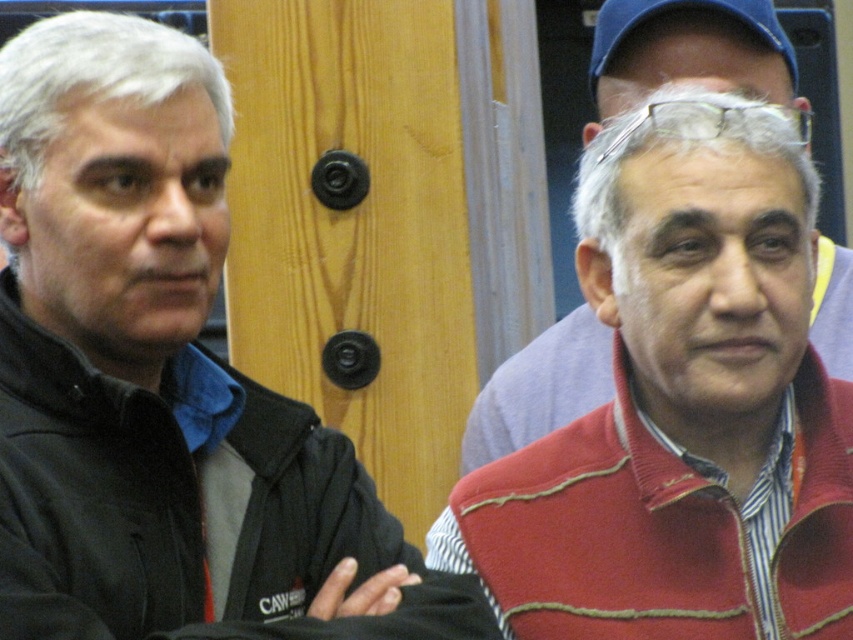
From the picture: You are a photographer trying to capture a group photo of the gray matte hair at upper left and the red matte sweater at right. Since you want to frame them symmetrically, which object should be placed closer to the center?

The gray matte hair at upper left should be placed closer to the center because it is positioned to the left of the red matte sweater at right, so moving it towards the center would help balance their positions.

You are a photographer taking a picture of the scene. You notice the gray matte hair at upper left and the blue fabric cap at upper center. Which object should you focus on first if you want to capture both in the same frame without moving the camera?

The gray matte hair at upper left is located below the blue fabric cap at upper center, so you should focus on the blue fabric cap at upper center first since it is higher up and will ensure both are in frame.

You are an artist sketching this scene. You need to decide which of the two gray matte hair areas, the gray matte hair at upper left or the gray matte hair at center, requires less space in your drawing. Which one should you allocate less width to?

The gray matte hair at upper left has a lesser width compared to gray matte hair at center, so you should allocate less width to the gray matte hair at upper left in your drawing.